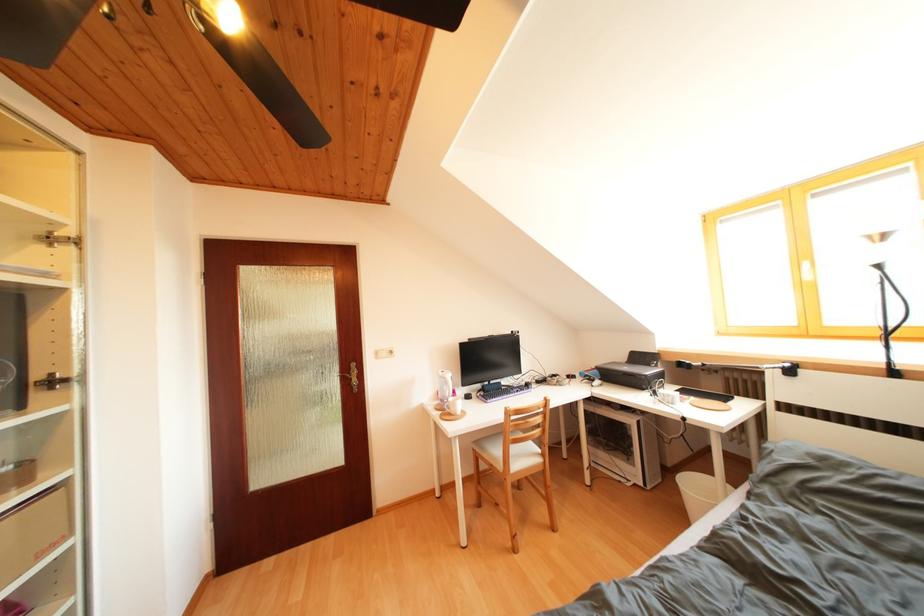
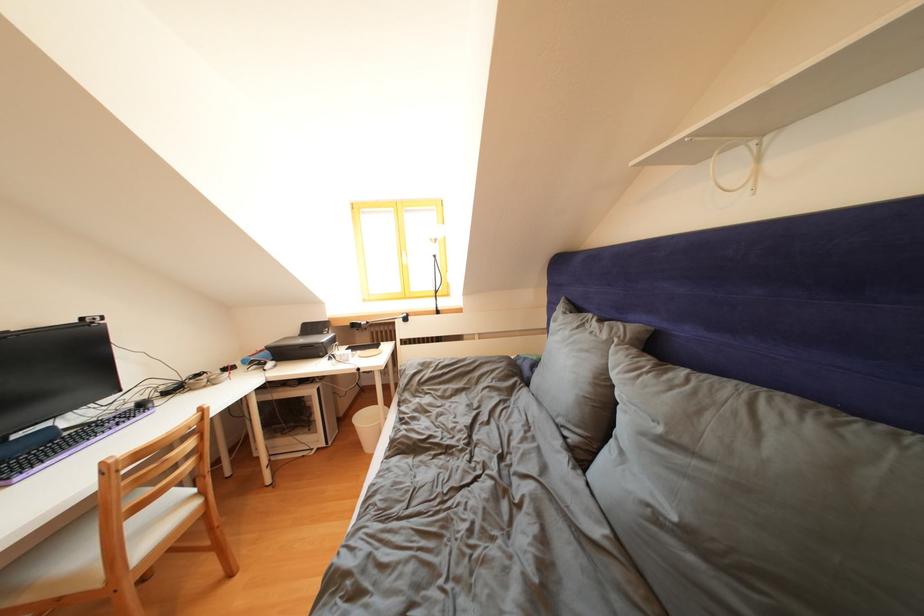
The point at (697,488) is marked in the first image. Where is the corresponding point in the second image?

(371, 424)